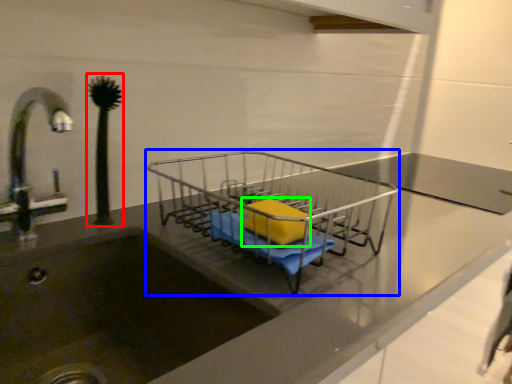
Question: Which is nearer to the plant (highlighted by a red box)? trolley (highlighted by a blue box) or material (highlighted by a green box).

Choices:
 (A) trolley
 (B) material

Answer: (B)